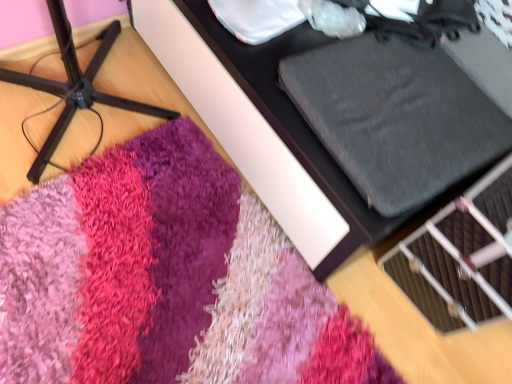
Find the location of a particular element. free space in front of textured gray cushion at upper right, arranged as the 1th furniture when viewed from the right is located at coordinates (209, 271).